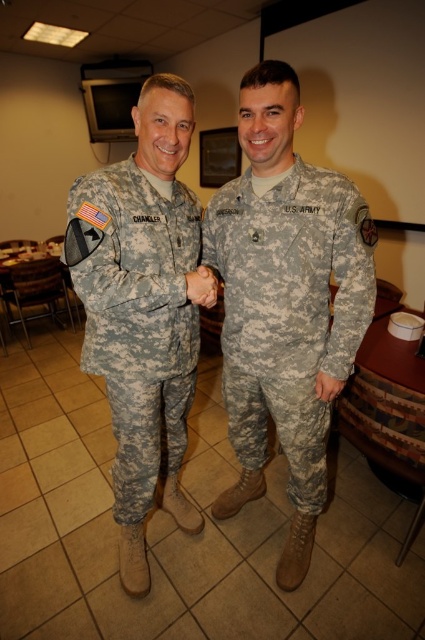
Is camouflage uniform at center further to camera compared to camouflage fabric uniform at center?

No.

Is point (186, 301) closer to viewer compared to point (354, 301)?

Yes, point (186, 301) is closer to viewer.

Between point (285, 433) and point (311, 493), which one is positioned behind?

Point (311, 493)

This screenshot has width=425, height=640. In order to click on camouflage uniform at center in this screenshot , I will do `click(224, 308)`.

Where is `camouflage fabric uniform at center`? This screenshot has height=640, width=425. camouflage fabric uniform at center is located at coordinates (289, 310).

Does camouflage fabric uniform at center appear over camouflage fabric uniform at left?

Correct, camouflage fabric uniform at center is located above camouflage fabric uniform at left.

Find the location of a particular element. This screenshot has height=640, width=425. camouflage fabric uniform at center is located at coordinates (289, 310).

Measure the distance from camouflage fabric uniform at center to matte camouflage hand at center.

The distance of camouflage fabric uniform at center from matte camouflage hand at center is 12.29 inches.

Can you confirm if camouflage fabric uniform at center is positioned below matte camouflage hand at center?

Correct, camouflage fabric uniform at center is located below matte camouflage hand at center.

Which is behind, point (263, 216) or point (187, 284)?

The point (263, 216) is behind.

Find the location of a particular element. camouflage fabric uniform at center is located at coordinates (289, 310).